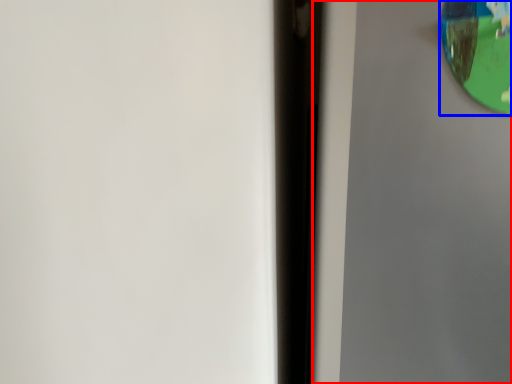
Question: Which object appears closest to the camera in this image, screen door (highlighted by a red box) or view mirror (highlighted by a blue box)?

Choices:
 (A) screen door
 (B) view mirror

Answer: (A)